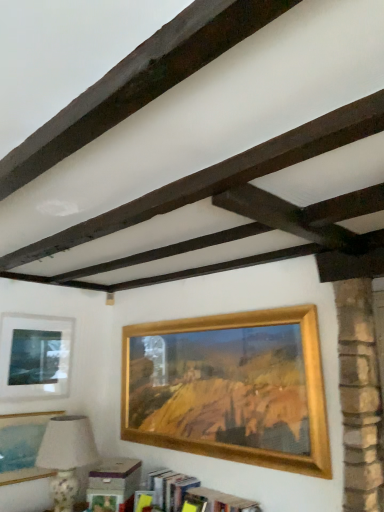
Question: From a real-world perspective, is matte glass picture frame at upper left, the third picture frame when ordered from right to left, physically located above or below dark brown wood at upper center?

Choices:
 (A) above
 (B) below

Answer: (B)

Question: Do you think matte glass picture frame at upper left, the 1th picture frame from the left, is within dark brown wood at upper center, or outside of it?

Choices:
 (A) outside
 (B) inside

Answer: (A)

Question: Which of these objects is positioned closest to the porcelain floral table lamp at lower left?

Choices:
 (A) dark brown wood at upper center
 (B) matte glass picture frame at upper left, the third picture frame when ordered from right to left
 (C) matte gold picture frame at lower left, which is the second picture frame from left to right
 (D) gold wooden picture frame at center, marked as the 3th picture frame in a left-to-right arrangement
 (E) wooden bookshelf at lower center

Answer: (C)

Question: Which is farther from the porcelain floral table lamp at lower left?

Choices:
 (A) matte gold picture frame at lower left, arranged as the 2th picture frame when viewed from the right
 (B) wooden bookshelf at lower center
 (C) gold wooden picture frame at center, marked as the 3th picture frame in a left-to-right arrangement
 (D) matte glass picture frame at upper left, the 1th picture frame from the left
 (E) dark brown wood at upper center

Answer: (E)